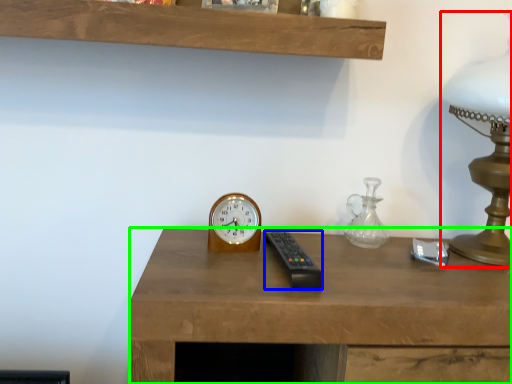
Question: Based on their relative distances, which object is nearer to table lamp (highlighted by a red box)? Choose from control (highlighted by a blue box) and desk (highlighted by a green box).

Choices:
 (A) control
 (B) desk

Answer: (B)